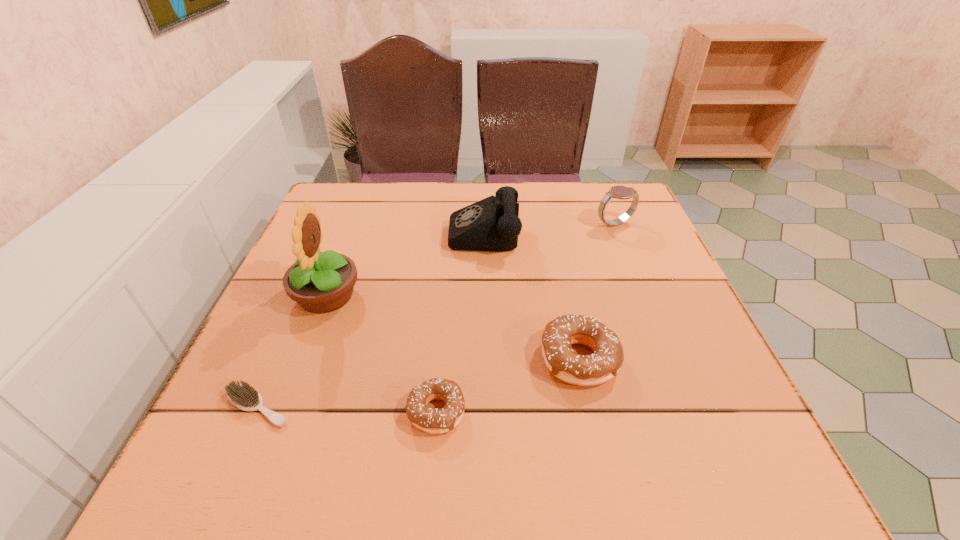
Find the location of a particular element. The image size is (960, 540). empty space between the second tallest object and the left doughnut is located at coordinates (460, 320).

Identify the location of free space between the taller doughnut and the third farthest object. Image resolution: width=960 pixels, height=540 pixels. (453, 327).

Locate an element on the screen. Image resolution: width=960 pixels, height=540 pixels. empty space between the sunflower and the watch is located at coordinates (470, 260).

At what (x,y) coordinates should I click in order to perform the action: click on vacant point located between the fourth tallest object and the fifth tallest object. Please return your answer as a coordinate pair (x, y). Looking at the image, I should click on (508, 385).

Select which object appears as the fifth closest to the left doughnut. Please provide its 2D coordinates. Your answer should be formatted as a tuple, i.e. [(x, y)], where the tuple contains the x and y coordinates of a point satisfying the conditions above.

[(620, 192)]

Locate an element on the screen. The width and height of the screenshot is (960, 540). the second closest object to the scrubbing brush is located at coordinates (431, 420).

This screenshot has width=960, height=540. I want to click on free location that satisfies the following two spatial constraints: 1. on the face of the third shortest object; 2. on the left side of the third farthest object, so click(302, 359).

Locate an element on the screen. The width and height of the screenshot is (960, 540). vacant space that satisfies the following two spatial constraints: 1. on the front side of the shorter doughnut; 2. on the left side of the scrubbing brush is located at coordinates (255, 411).

You are a GUI agent. You are given a task and a screenshot of the screen. Output one action in this format:
    pyautogui.click(x=<x>, y=<y>)
    Task: Click on the free space that satisfies the following two spatial constraints: 1. on the dial of the telephone; 2. on the front side of the scrubbing brush
    The height and width of the screenshot is (540, 960).
    Given the screenshot: What is the action you would take?
    pyautogui.click(x=486, y=407)